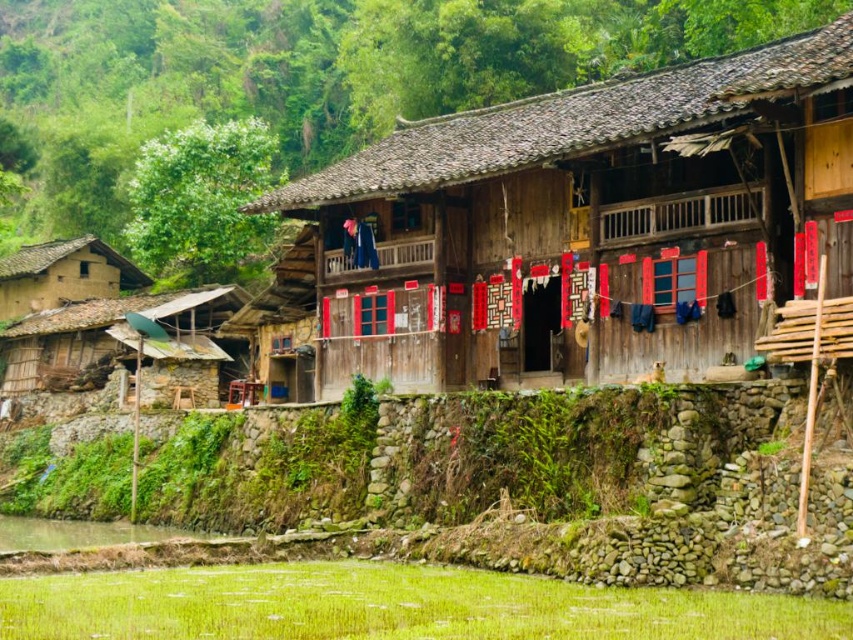
Is the position of rustic wooden hut at left less distant than that of brown mud hut at left?

Yes, rustic wooden hut at left is closer to the viewer.

This screenshot has height=640, width=853. What are the coordinates of `rustic wooden hut at left` in the screenshot? It's located at (125, 344).

Identify the location of rustic wooden hut at left. The width and height of the screenshot is (853, 640). (125, 344).

Is wooden house at center shorter than brown mud hut at left?

No.

Who is lower down, wooden house at center or brown mud hut at left?

brown mud hut at left

This screenshot has height=640, width=853. What are the coordinates of `wooden house at center` in the screenshot? It's located at (584, 218).

Identify the location of wooden house at center. This screenshot has width=853, height=640. (584, 218).

Is wooden house at center positioned at the back of rustic wooden hut at left?

No, it is not.

Does wooden house at center lie in front of rustic wooden hut at left?

Yes, it is.

Does point (379, 144) come behind point (86, 307)?

No.

Find the location of a particular element. The image size is (853, 640). wooden house at center is located at coordinates (584, 218).